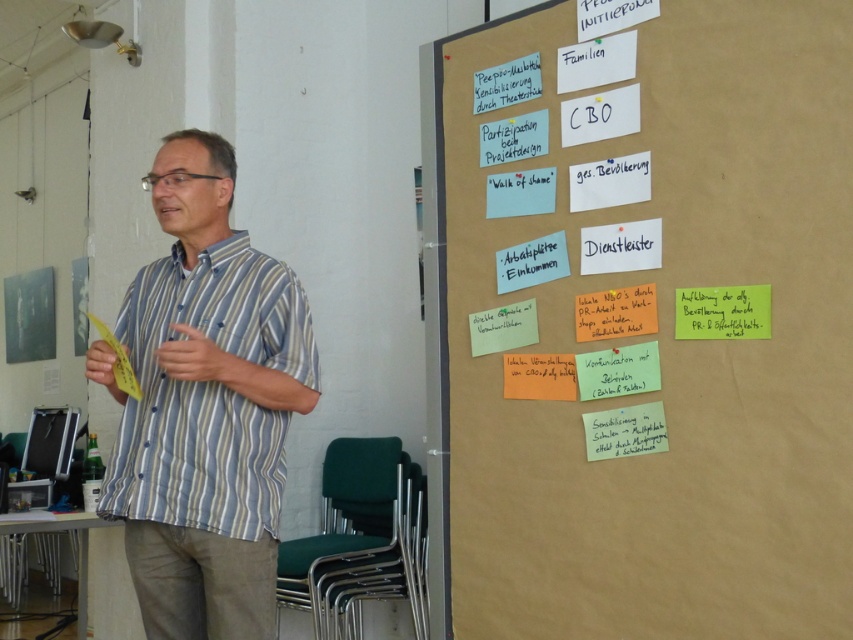
Does point (850, 496) come farther from viewer compared to point (312, 358)?

That is False.

Does white paper notes at upper right have a lesser height compared to striped cotton shirt at center?

In fact, white paper notes at upper right may be taller than striped cotton shirt at center.

Where is `white paper notes at upper right`? white paper notes at upper right is located at coordinates coord(643,320).